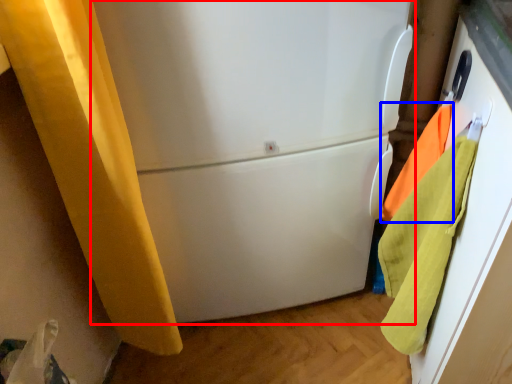
Question: Which point is closer to the camera, refrigerator (highlighted by a red box) or beach towel (highlighted by a blue box)?

Choices:
 (A) refrigerator
 (B) beach towel

Answer: (A)